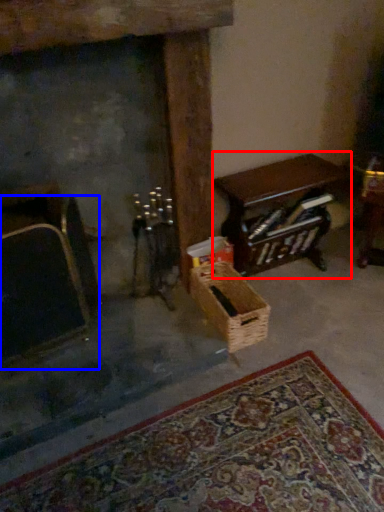
Question: Which point is closer to the camera, table (highlighted by a red box) or armchair (highlighted by a blue box)?

Choices:
 (A) table
 (B) armchair

Answer: (B)